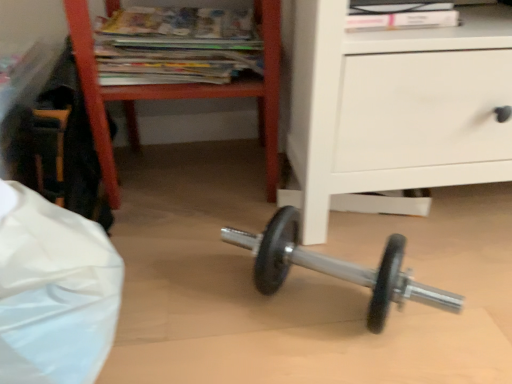
This screenshot has height=384, width=512. What are the coordinates of `vacant point above matte paper magazines at upper center (from a real-world perspective)` in the screenshot? It's located at (174, 9).